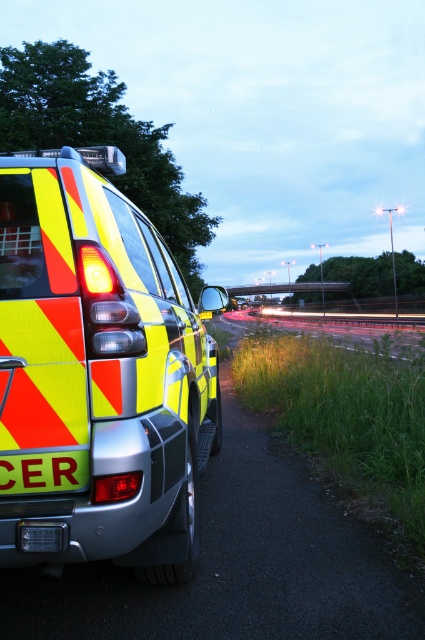
You are a driver approaching the yellow reflective sign at lower left and need to stay on the metallic asphalt highway at center. Can you estimate if the highway is wide enough to safely navigate around the sign without crossing into another lane?

The metallic asphalt highway at center might be wider than yellow reflective sign at lower left, so it is likely wide enough to navigate safely without crossing lanes.

You are standing on the side of the road where the emergency vehicle is parked. You notice two points marked on the road ahead. The first point is at coordinates point (42, 504) and the second is at point (31, 480). Which point is closer to your current position?

Point (42, 504) is closer to the viewer than point (31, 480).

You are a drone operator trying to capture the metallic asphalt highway at center in your camera frame. The drone is currently hovering at point coordinates of (x=342, y=328). Is the drone positioned directly above the metallic asphalt highway at center?

The point coordinates of (x=342, y=328) correspond to the metallic asphalt highway at center, so yes, the drone is positioned directly above the metallic asphalt highway at center.